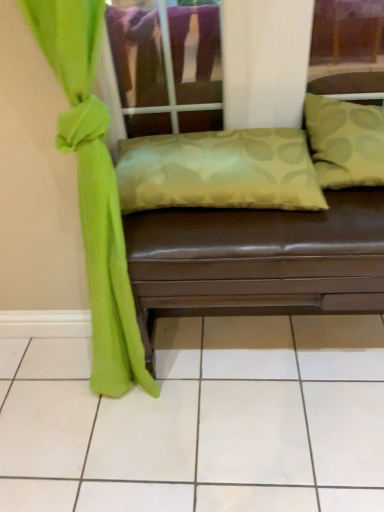
Describe the element at coordinates (345, 142) in the screenshot. The width and height of the screenshot is (384, 512). I see `green fabric pillow at upper right, which is the second pillow in left-to-right order` at that location.

You are a GUI agent. You are given a task and a screenshot of the screen. Output one action in this format:
    pyautogui.click(x=<x>, y=<y>)
    Task: Click on the green fabric pillow at upper right, which ranks as the 1th pillow in right-to-left order
    
    Given the screenshot: What is the action you would take?
    pyautogui.click(x=345, y=142)

Could you tell me if green fabric pillow at upper right, which is the second pillow in left-to-right order, is facing silky green pillow at center?

No, green fabric pillow at upper right, which is the second pillow in left-to-right order, is not facing towards silky green pillow at center.

Does green fabric pillow at upper right, which ranks as the 1th pillow in right-to-left order, have a larger size compared to silky green pillow at center?

No, green fabric pillow at upper right, which ranks as the 1th pillow in right-to-left order, is not bigger than silky green pillow at center.

Does green fabric pillow at upper right, which is the second pillow in left-to-right order, have a lesser height compared to silky green pillow at center?

Correct, green fabric pillow at upper right, which is the second pillow in left-to-right order, is not as tall as silky green pillow at center.

Considering the positions of objects silky green pillow at center and green fabric pillow at upper right, which is the second pillow in left-to-right order, in the image provided, who is in front, silky green pillow at center or green fabric pillow at upper right, which is the second pillow in left-to-right order,?

silky green pillow at center is closer to the camera.

Are silky green pillow at center and green fabric pillow at upper right, which is the second pillow in left-to-right order, beside each other?

There is a gap between silky green pillow at center and green fabric pillow at upper right, which is the second pillow in left-to-right order.

From the image's perspective, is silky green pillow at center over green fabric pillow at upper right, which is the second pillow in left-to-right order?

No, from the image's perspective, silky green pillow at center is not over green fabric pillow at upper right, which is the second pillow in left-to-right order.

Does point (135, 241) lie in front of point (372, 111)?

Yes, it is.

Which object is wider, green fabric curtain at left or silky green pillow at center?

With larger width is silky green pillow at center.

Is green fabric curtain at left not close to silky green pillow at center?

No, green fabric curtain at left is not far from silky green pillow at center.

How many degrees apart are the facing directions of green fabric curtain at left and silky green pillow at center?

4.4 degrees separate the facing orientations of green fabric curtain at left and silky green pillow at center.

From the picture: Measure the distance from green fabric curtain at left to silky green pillow at center.

They are 11.21 inches apart.

Is satin green pillow at center, placed as the 1th pillow when sorted from left to right, wider or thinner than green fabric curtain at left?

satin green pillow at center, placed as the 1th pillow when sorted from left to right, is wider than green fabric curtain at left.

Is satin green pillow at center, placed as the 1th pillow when sorted from left to right, positioned beyond the bounds of green fabric curtain at left?

That's correct, satin green pillow at center, placed as the 1th pillow when sorted from left to right, is outside of green fabric curtain at left.

Can you confirm if satin green pillow at center, placed as the 1th pillow when sorted from left to right, is shorter than green fabric curtain at left?

Yes.

Which object is positioned more to the left, silky green pillow at center or satin green pillow at center, placed as the 1th pillow when sorted from left to right?

From the viewer's perspective, satin green pillow at center, placed as the 1th pillow when sorted from left to right, appears more on the left side.

Would you say silky green pillow at center is inside or outside satin green pillow at center, placed as the 2th pillow when sorted from right to left?

The correct answer is: outside.

Is silky green pillow at center looking in the opposite direction of satin green pillow at center, placed as the 1th pillow when sorted from left to right?

silky green pillow at center is not turned away from satin green pillow at center, placed as the 1th pillow when sorted from left to right.

Considering the sizes of objects silky green pillow at center and satin green pillow at center, placed as the 1th pillow when sorted from left to right, in the image provided, who is shorter, silky green pillow at center or satin green pillow at center, placed as the 1th pillow when sorted from left to right,?

satin green pillow at center, placed as the 1th pillow when sorted from left to right.

Between satin green pillow at center, placed as the 2th pillow when sorted from right to left, and green fabric pillow at upper right, which is the second pillow in left-to-right order, which one has less height?

With less height is satin green pillow at center, placed as the 2th pillow when sorted from right to left.

From a real-world perspective, who is located lower, satin green pillow at center, placed as the 1th pillow when sorted from left to right, or green fabric pillow at upper right, which ranks as the 1th pillow in right-to-left order?

satin green pillow at center, placed as the 1th pillow when sorted from left to right, from a real-world perspective.

Could you tell me if satin green pillow at center, placed as the 1th pillow when sorted from left to right, is turned towards green fabric pillow at upper right, which ranks as the 1th pillow in right-to-left order?

No, satin green pillow at center, placed as the 1th pillow when sorted from left to right, is not aimed at green fabric pillow at upper right, which ranks as the 1th pillow in right-to-left order.

Considering the points (214, 170) and (365, 102), which point is in front, point (214, 170) or point (365, 102)?

The point (214, 170) is more forward.

From the image's perspective, is satin green pillow at center, placed as the 1th pillow when sorted from left to right, located above or below silky green pillow at center?

From the image's perspective, satin green pillow at center, placed as the 1th pillow when sorted from left to right, appears above silky green pillow at center.

Is satin green pillow at center, placed as the 1th pillow when sorted from left to right, oriented towards silky green pillow at center?

No, satin green pillow at center, placed as the 1th pillow when sorted from left to right, is not oriented towards silky green pillow at center.

Is satin green pillow at center, placed as the 2th pillow when sorted from right to left, taller or shorter than silky green pillow at center?

satin green pillow at center, placed as the 2th pillow when sorted from right to left, is shorter than silky green pillow at center.

The height and width of the screenshot is (512, 384). Identify the location of pillow that appears on the right of silky green pillow at center. (345, 142).

In order to click on the 1st pillow behind the silky green pillow at center in this screenshot , I will do `click(345, 142)`.

In the scene shown: When comparing their distances from satin green pillow at center, placed as the 2th pillow when sorted from right to left, does silky green pillow at center or green fabric pillow at upper right, which ranks as the 1th pillow in right-to-left order, seem further?

green fabric pillow at upper right, which ranks as the 1th pillow in right-to-left order, is further to satin green pillow at center, placed as the 2th pillow when sorted from right to left.

From the image, which object appears to be nearer to silky green pillow at center, green fabric pillow at upper right, which is the second pillow in left-to-right order, or satin green pillow at center, placed as the 1th pillow when sorted from left to right?

Among the two, satin green pillow at center, placed as the 1th pillow when sorted from left to right, is located nearer to silky green pillow at center.

Looking at the image, which one is located further to green fabric pillow at upper right, which ranks as the 1th pillow in right-to-left order, green fabric curtain at left or silky green pillow at center?

green fabric curtain at left is further to green fabric pillow at upper right, which ranks as the 1th pillow in right-to-left order.

When comparing their distances from silky green pillow at center, does satin green pillow at center, placed as the 1th pillow when sorted from left to right, or green fabric pillow at upper right, which is the second pillow in left-to-right order, seem closer?

Based on the image, satin green pillow at center, placed as the 1th pillow when sorted from left to right, appears to be nearer to silky green pillow at center.

Considering their positions, is satin green pillow at center, placed as the 1th pillow when sorted from left to right, positioned closer to green fabric curtain at left than green fabric pillow at upper right, which is the second pillow in left-to-right order?

satin green pillow at center, placed as the 1th pillow when sorted from left to right, is positioned closer to the anchor green fabric curtain at left.

Looking at the image, which one is located closer to green fabric pillow at upper right, which ranks as the 1th pillow in right-to-left order, satin green pillow at center, placed as the 1th pillow when sorted from left to right, or silky green pillow at center?

The object closer to green fabric pillow at upper right, which ranks as the 1th pillow in right-to-left order, is satin green pillow at center, placed as the 1th pillow when sorted from left to right.

Considering their positions, is silky green pillow at center positioned further to green fabric pillow at upper right, which ranks as the 1th pillow in right-to-left order, than satin green pillow at center, placed as the 2th pillow when sorted from right to left?

silky green pillow at center is positioned further to the anchor green fabric pillow at upper right, which ranks as the 1th pillow in right-to-left order.

Looking at the image, which one is located further to silky green pillow at center, satin green pillow at center, placed as the 2th pillow when sorted from right to left, or green fabric curtain at left?

The object further to silky green pillow at center is green fabric curtain at left.

I want to click on pillow located between green fabric curtain at left and silky green pillow at center in the left-right direction, so click(x=219, y=170).

Find the location of a particular element. This screenshot has width=384, height=512. pillow situated between green fabric curtain at left and green fabric pillow at upper right, which is the second pillow in left-to-right order, from left to right is located at coordinates (219, 170).

What are the coordinates of `studio couch located between green fabric curtain at left and green fabric pillow at upper right, which ranks as the 1th pillow in right-to-left order, in the left-right direction` in the screenshot? It's located at (257, 261).

Locate an element on the screen. studio couch between satin green pillow at center, placed as the 2th pillow when sorted from right to left, and green fabric pillow at upper right, which is the second pillow in left-to-right order, from left to right is located at coordinates (257, 261).